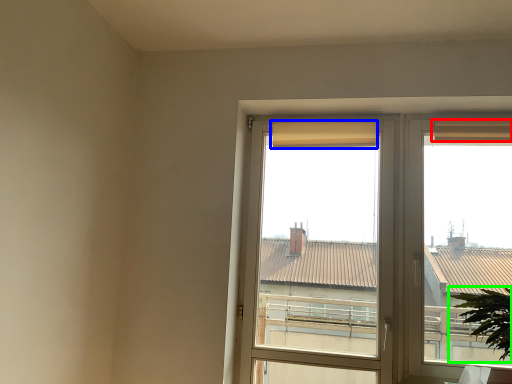
Question: Which is nearer to the curtain (highlighted by a red box)? curtain (highlighted by a blue box) or houseplant (highlighted by a green box).

Choices:
 (A) curtain
 (B) houseplant

Answer: (A)